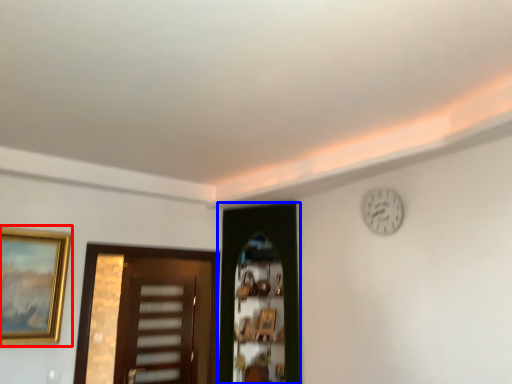
Question: Which object appears farthest to the camera in this image, picture frame (highlighted by a red box) or door (highlighted by a blue box)?

Choices:
 (A) picture frame
 (B) door

Answer: (B)